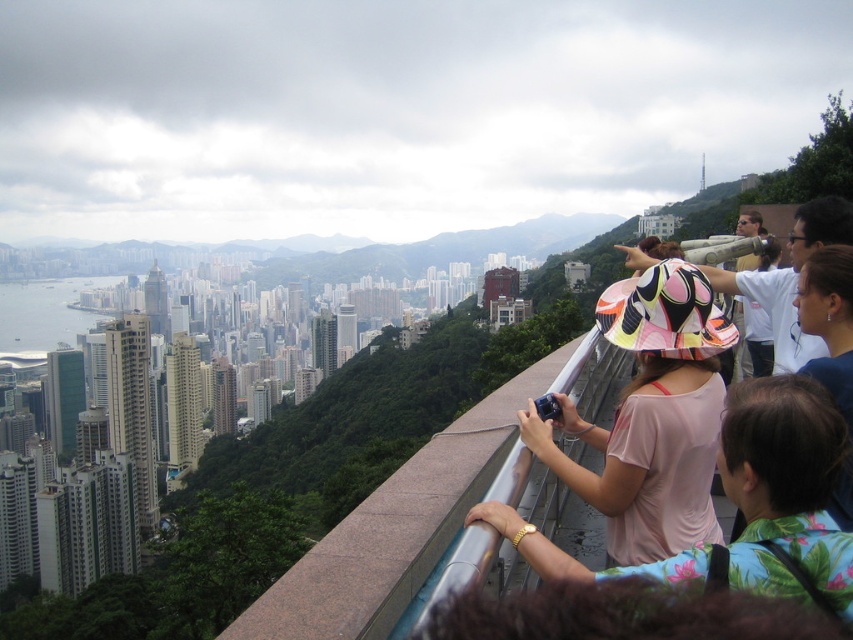
Can you confirm if pink fabric hat at center is smaller than pink fabric dress at center?

Indeed, pink fabric hat at center has a smaller size compared to pink fabric dress at center.

Which is in front, point (610, 449) or point (837, 461)?

Point (837, 461) is in front.

Measure the distance between pink fabric hat at center and camera.

A distance of 617.11 meters exists between pink fabric hat at center and camera.

Locate an element on the screen. This screenshot has height=640, width=853. pink fabric hat at center is located at coordinates (651, 417).

Which is above, pink fabric hat at center or blue fabric at upper right?

blue fabric at upper right is above.

Does pink fabric hat at center come in front of blue fabric at upper right?

No, it is not.

Locate an element on the screen. The width and height of the screenshot is (853, 640). pink fabric hat at center is located at coordinates (651, 417).

Based on the photo, who is more distant from viewer, (x=827, y=442) or (x=834, y=352)?

Point (x=834, y=352)

Locate an element on the screen. This screenshot has width=853, height=640. pink fabric dress at center is located at coordinates (747, 504).